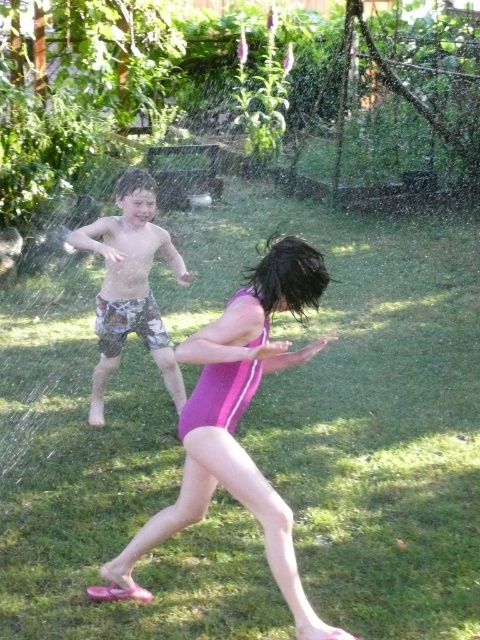
Is green grass at center bigger than purple matte swimsuit at center?

No, green grass at center is not bigger than purple matte swimsuit at center.

Can you confirm if green grass at center is thinner than purple matte swimsuit at center?

Incorrect, green grass at center's width is not less than purple matte swimsuit at center's.

Between point (287, 401) and point (242, 362), which one is positioned in front?

Point (242, 362)

Locate an element on the screen. The image size is (480, 640). green grass at center is located at coordinates (362, 404).

Is purple matte swimsuit at center to the left of camouflage shorts at left from the viewer's perspective?

Incorrect, purple matte swimsuit at center is not on the left side of camouflage shorts at left.

What do you see at coordinates (235, 424) in the screenshot? This screenshot has width=480, height=640. I see `purple matte swimsuit at center` at bounding box center [235, 424].

Between point (276, 540) and point (96, 307), which one is positioned behind?

Positioned behind is point (96, 307).

Where is `purple matte swimsuit at center`? This screenshot has width=480, height=640. purple matte swimsuit at center is located at coordinates (235, 424).

Between point (300, 532) and point (151, 301), which one is positioned in front?

Point (300, 532)

Is green grass at center further to camera compared to camouflage shorts at left?

Yes.

At what (x,y) coordinates should I click in order to perform the action: click on green grass at center. Please return your answer as a coordinate pair (x, y). Looking at the image, I should click on (362, 404).

Where is `green grass at center`? green grass at center is located at coordinates (362, 404).